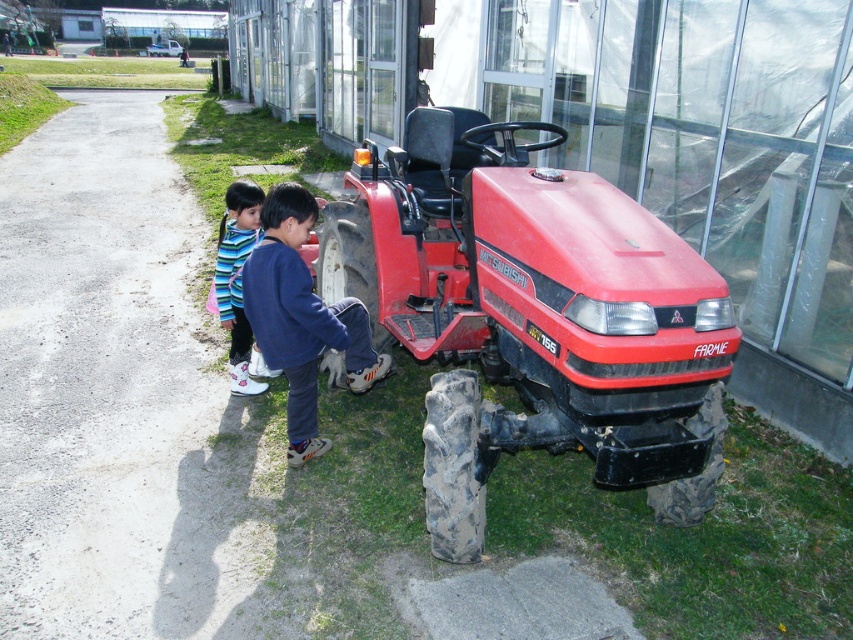
Question: Can you confirm if red matte tractor at center is positioned to the right of striped fabric shoes at lower left?

Choices:
 (A) yes
 (B) no

Answer: (A)

Question: Which of these objects is positioned closest to the blue fleece jacket at center?

Choices:
 (A) striped fabric shoes at lower left
 (B) red matte tractor at center

Answer: (A)

Question: Is red matte tractor at center bigger than striped fabric shoes at lower left?

Choices:
 (A) no
 (B) yes

Answer: (B)

Question: Which point is closer to the camera taking this photo?

Choices:
 (A) (300, 289)
 (B) (218, 241)

Answer: (A)

Question: Is red matte tractor at center in front of blue fleece jacket at center?

Choices:
 (A) yes
 (B) no

Answer: (A)

Question: Which point appears farthest from the camera in this image?

Choices:
 (A) (296, 444)
 (B) (231, 280)
 (C) (676, 484)

Answer: (B)